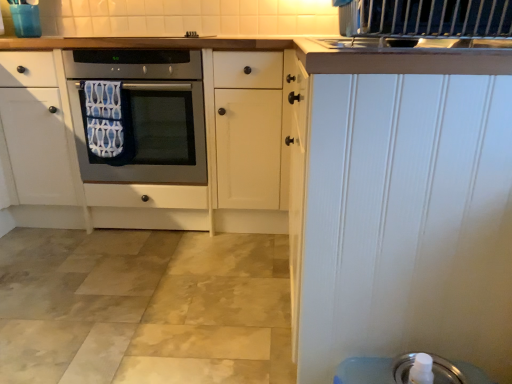
Question: Could you tell me if blue patterned towel at center is turned towards satin silver oven at center?

Choices:
 (A) no
 (B) yes

Answer: (B)

Question: Does blue patterned towel at center have a lesser height compared to satin silver oven at center?

Choices:
 (A) no
 (B) yes

Answer: (B)

Question: Can you confirm if blue patterned towel at center is smaller than satin silver oven at center?

Choices:
 (A) yes
 (B) no

Answer: (A)

Question: Can satin silver oven at center be found inside blue patterned towel at center?

Choices:
 (A) yes
 (B) no

Answer: (B)

Question: Is blue patterned towel at center taller than satin silver oven at center?

Choices:
 (A) no
 (B) yes

Answer: (A)

Question: In terms of size, does silver metallic soap dispenser at lower right appear bigger or smaller than blue patterned towel at center?

Choices:
 (A) big
 (B) small

Answer: (B)

Question: From their relative heights in the image, would you say silver metallic soap dispenser at lower right is taller or shorter than blue patterned towel at center?

Choices:
 (A) tall
 (B) short

Answer: (B)

Question: From the image's perspective, is silver metallic soap dispenser at lower right located above or below blue patterned towel at center?

Choices:
 (A) below
 (B) above

Answer: (A)

Question: Is silver metallic soap dispenser at lower right inside the boundaries of blue patterned towel at center, or outside?

Choices:
 (A) outside
 (B) inside

Answer: (A)

Question: From a real-world perspective, is white painted wood door at upper right above or below satin silver oven at center?

Choices:
 (A) below
 (B) above

Answer: (A)

Question: Considering the positions of point (387, 236) and point (123, 130), is point (387, 236) closer or farther from the camera than point (123, 130)?

Choices:
 (A) closer
 (B) farther

Answer: (A)

Question: Looking at their shapes, would you say white painted wood door at upper right is wider or thinner than satin silver oven at center?

Choices:
 (A) wide
 (B) thin

Answer: (B)

Question: Considering the positions of white painted wood door at upper right and satin silver oven at center in the image, is white painted wood door at upper right taller or shorter than satin silver oven at center?

Choices:
 (A) tall
 (B) short

Answer: (A)

Question: Is white painted wood door at upper right in front of or behind blue patterned towel at center in the image?

Choices:
 (A) behind
 (B) front

Answer: (B)

Question: Does point (472, 86) appear closer or farther from the camera than point (104, 137)?

Choices:
 (A) closer
 (B) farther

Answer: (A)